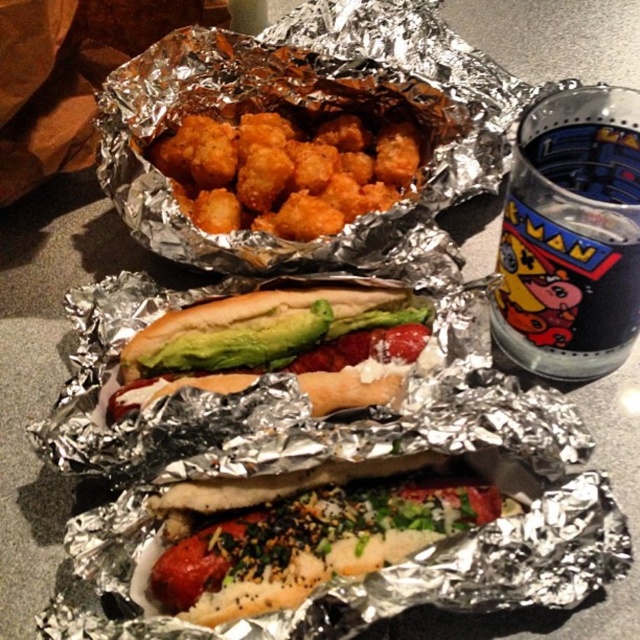
In the scene shown: You are a food delivery person who needs to place a small note on the table near the sesame seed bun hot dog at center. The note must be placed exactly at point (308, 541). Is the note placed on the table or on the aluminum foil?

The note placed at point (308, 541) is on the aluminum foil because the sesame seed bun hot dog at center is located at that point, and the hot dogs are placed on the crinkled aluminum foil.

You are holding a small toy that is 15 inches long. You want to place it on the table so that it points towards the point at coordinates point (292, 600). Will the entire toy fit on the table without hanging off the edge?

The distance of point (292, 600) from camera is 17.23 inches. Since the toy is 15 inches long, it can be placed pointing towards that point and still fit entirely on the table as the distance from the camera to the point is greater than the toy length.

What are the coordinates of the sesame seed bun hot dog at center?

The sesame seed bun hot dog at center is located at point (308,541).